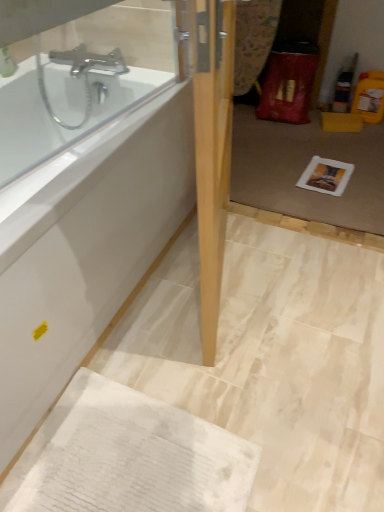
At what (x,y) coordinates should I click in order to perform the action: click on vacant space behind white textured towel at lower left. Please return your answer as a coordinate pair (x, y). This screenshot has height=512, width=384. Looking at the image, I should click on (181, 340).